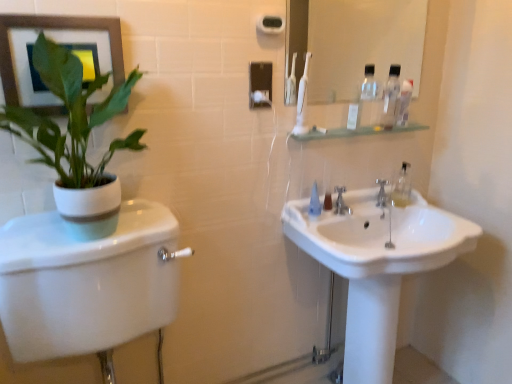
Question: Could you tell me if clear plastic mouthwash at upper right, which is the 2th mouthwash in left-to-right order, is turned towards green matte plant at left?

Choices:
 (A) no
 (B) yes

Answer: (A)

Question: From a real-world perspective, is clear plastic mouthwash at upper right, the 1th mouthwash positioned from the right, over green matte plant at left?

Choices:
 (A) no
 (B) yes

Answer: (B)

Question: From the image's perspective, is clear plastic mouthwash at upper right, which appears as the first mouthwash when viewed from the back, on top of green matte plant at left?

Choices:
 (A) no
 (B) yes

Answer: (B)

Question: From a real-world perspective, is clear plastic mouthwash at upper right, which appears as the first mouthwash when viewed from the back, positioned under green matte plant at left based on gravity?

Choices:
 (A) no
 (B) yes

Answer: (A)

Question: Considering the relative positions of clear plastic mouthwash at upper right, the 1th mouthwash positioned from the right, and green matte plant at left in the image provided, is clear plastic mouthwash at upper right, the 1th mouthwash positioned from the right, to the right of green matte plant at left from the viewer's perspective?

Choices:
 (A) no
 (B) yes

Answer: (B)

Question: Considering the relative sizes of clear plastic mouthwash at upper right, the 1th mouthwash positioned from the right, and green matte plant at left in the image provided, is clear plastic mouthwash at upper right, the 1th mouthwash positioned from the right, taller than green matte plant at left?

Choices:
 (A) yes
 (B) no

Answer: (B)

Question: Does white glossy mirror at upper center have a lesser width compared to clear plastic bottle at upper right?

Choices:
 (A) no
 (B) yes

Answer: (B)

Question: Is white glossy mirror at upper center located outside clear plastic bottle at upper right?

Choices:
 (A) yes
 (B) no

Answer: (A)

Question: Considering the relative positions of white glossy mirror at upper center and clear plastic bottle at upper right in the image provided, is white glossy mirror at upper center to the right of clear plastic bottle at upper right from the viewer's perspective?

Choices:
 (A) no
 (B) yes

Answer: (A)

Question: Considering the relative sizes of white glossy mirror at upper center and clear plastic bottle at upper right in the image provided, is white glossy mirror at upper center wider than clear plastic bottle at upper right?

Choices:
 (A) no
 (B) yes

Answer: (A)

Question: From a real-world perspective, is white glossy mirror at upper center under clear plastic bottle at upper right?

Choices:
 (A) yes
 (B) no

Answer: (B)

Question: Does white glossy mirror at upper center lie in front of clear plastic bottle at upper right?

Choices:
 (A) yes
 (B) no

Answer: (A)

Question: Is clear plastic bottle at upper right closer to camera compared to white plastic toothpaste tube at upper center?

Choices:
 (A) no
 (B) yes

Answer: (A)